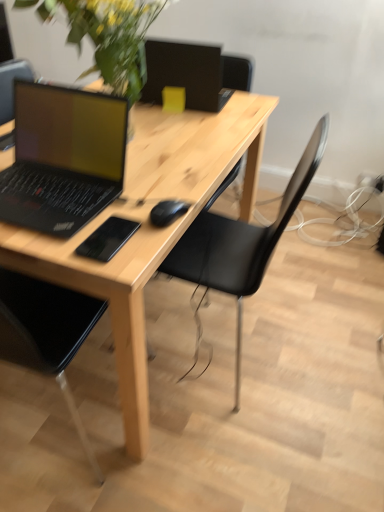
Find the location of a particular element. The image size is (384, 512). vacant space situated on the left part of black matte mousepad at center is located at coordinates (54, 237).